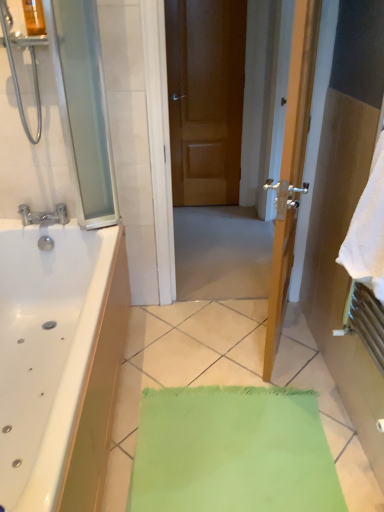
Question: Would you consider white soft towel at right to be distant from transparent glass screen door at left?

Choices:
 (A) no
 (B) yes

Answer: (B)

Question: Is transparent glass screen door at left inside white soft towel at right?

Choices:
 (A) yes
 (B) no

Answer: (B)

Question: Is white soft towel at right at the right side of transparent glass screen door at left?

Choices:
 (A) yes
 (B) no

Answer: (A)

Question: Could you tell me if white soft towel at right is facing transparent glass screen door at left?

Choices:
 (A) no
 (B) yes

Answer: (A)

Question: Does white soft towel at right come behind transparent glass screen door at left?

Choices:
 (A) yes
 (B) no

Answer: (B)

Question: Considering their positions, is transparent glass screen door at left located in front of or behind white soft towel at right?

Choices:
 (A) behind
 (B) front

Answer: (A)

Question: Is transparent glass screen door at left situated inside white soft towel at right or outside?

Choices:
 (A) inside
 (B) outside

Answer: (B)

Question: From a real-world perspective, is transparent glass screen door at left above or below white soft towel at right?

Choices:
 (A) below
 (B) above

Answer: (B)

Question: In terms of width, does transparent glass screen door at left look wider or thinner when compared to white soft towel at right?

Choices:
 (A) wide
 (B) thin

Answer: (B)

Question: Relative to transparent glass screen door at left, is white soft towel at right in front or behind?

Choices:
 (A) behind
 (B) front

Answer: (B)

Question: Would you say white soft towel at right is to the left or to the right of transparent glass screen door at left in the picture?

Choices:
 (A) left
 (B) right

Answer: (B)

Question: Is white soft towel at right taller or shorter than transparent glass screen door at left?

Choices:
 (A) short
 (B) tall

Answer: (A)

Question: From a real-world perspective, is white soft towel at right above or below transparent glass screen door at left?

Choices:
 (A) above
 (B) below

Answer: (B)

Question: Is transparent glass screen door at left inside or outside of brown wooden door at center?

Choices:
 (A) outside
 (B) inside

Answer: (A)

Question: From the image's perspective, is transparent glass screen door at left above or below brown wooden door at center?

Choices:
 (A) below
 (B) above

Answer: (A)